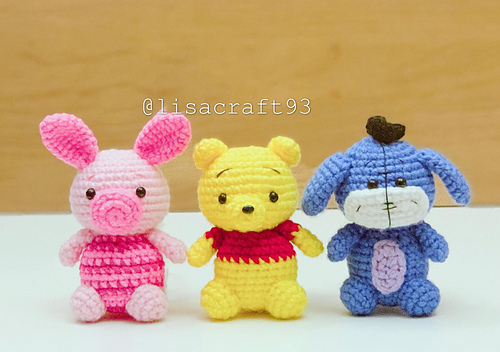
Where is `wooden wall`? wooden wall is located at coordinates (461, 126).